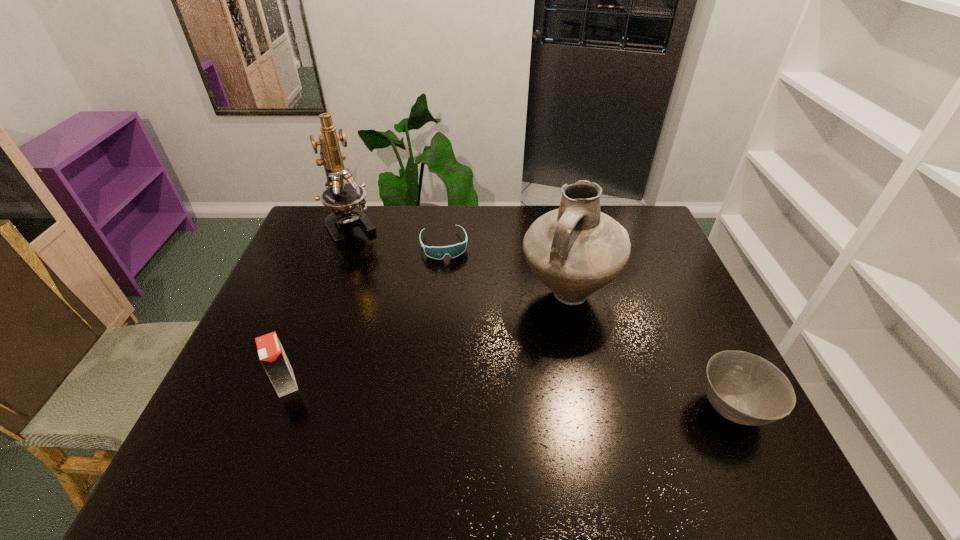
Locate an element on the screen. vacant spot on the desktop that is between the orange juice and the second shortest object and is positioned on the handle side of the pitcher is located at coordinates (551, 398).

Locate an element on the screen. The height and width of the screenshot is (540, 960). free spot on the desktop that is between the third shortest object and the second shortest object and is positioned on the front-facing side of the shortest object is located at coordinates (477, 394).

Find the location of a particular element. This screenshot has width=960, height=540. vacant space on the desktop that is between the orange juice and the fourth tallest object and is positioned at the eyepiece of the microscope is located at coordinates (462, 393).